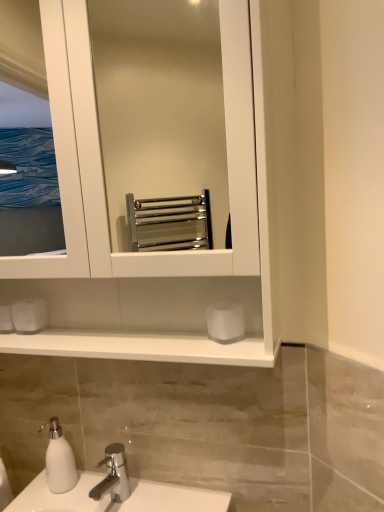
Question: Which direction should I rotate to look at white matte toilet paper at center, marked as the first toilet paper in a front-to-back arrangement?

Choices:
 (A) left
 (B) right

Answer: (B)

Question: Considering the relative sizes of white matte toilet paper at lower left, the first toilet paper from the back, and silver metallic tap at lower center in the image provided, is white matte toilet paper at lower left, the first toilet paper from the back, shorter than silver metallic tap at lower center?

Choices:
 (A) yes
 (B) no

Answer: (A)

Question: From the image's perspective, is white matte toilet paper at lower left, the first toilet paper positioned from the left, beneath silver metallic tap at lower center?

Choices:
 (A) yes
 (B) no

Answer: (B)

Question: From a real-world perspective, is white matte toilet paper at lower left, the first toilet paper positioned from the left, over silver metallic tap at lower center?

Choices:
 (A) no
 (B) yes

Answer: (B)

Question: Is the depth of white matte toilet paper at lower left, the first toilet paper positioned from the left, greater than that of silver metallic tap at lower center?

Choices:
 (A) no
 (B) yes

Answer: (B)

Question: Is white matte toilet paper at lower left, acting as the second toilet paper starting from the front, positioned beyond the bounds of silver metallic tap at lower center?

Choices:
 (A) no
 (B) yes

Answer: (B)

Question: From the image's perspective, does white matte toilet paper at lower left, acting as the second toilet paper starting from the front, appear higher than silver metallic tap at lower center?

Choices:
 (A) no
 (B) yes

Answer: (B)

Question: Can you confirm if silver metallic tap at lower center is positioned to the left of white matte soap dispenser at lower left?

Choices:
 (A) no
 (B) yes

Answer: (A)

Question: Is silver metallic tap at lower center thinner than white matte soap dispenser at lower left?

Choices:
 (A) no
 (B) yes

Answer: (A)

Question: Is silver metallic tap at lower center to the right of white matte soap dispenser at lower left from the viewer's perspective?

Choices:
 (A) no
 (B) yes

Answer: (B)

Question: Can we say silver metallic tap at lower center lies outside white matte soap dispenser at lower left?

Choices:
 (A) no
 (B) yes

Answer: (B)

Question: Can you confirm if silver metallic tap at lower center is wider than white matte soap dispenser at lower left?

Choices:
 (A) no
 (B) yes

Answer: (B)

Question: Considering the relative sizes of silver metallic tap at lower center and white matte soap dispenser at lower left in the image provided, is silver metallic tap at lower center shorter than white matte soap dispenser at lower left?

Choices:
 (A) yes
 (B) no

Answer: (A)

Question: Would you say white matte soap dispenser at lower left is outside white glossy towel rack at center?

Choices:
 (A) no
 (B) yes

Answer: (B)